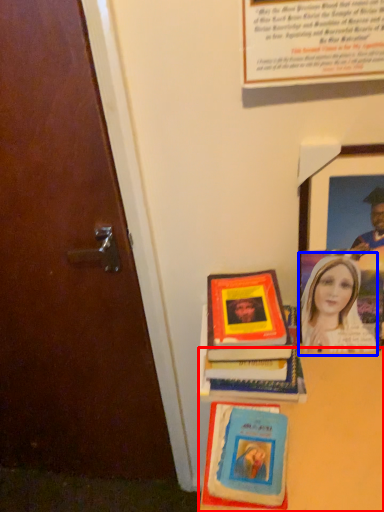
Question: Which object appears farthest to the camera in this image, table (highlighted by a red box) or woman (highlighted by a blue box)?

Choices:
 (A) table
 (B) woman

Answer: (B)